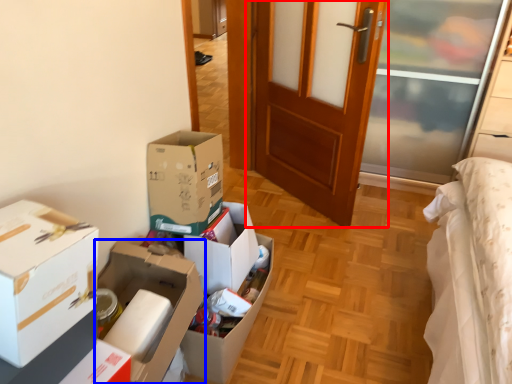
Question: Which object appears farthest to the camera in this image, door (highlighted by a red box) or box (highlighted by a blue box)?

Choices:
 (A) door
 (B) box

Answer: (A)